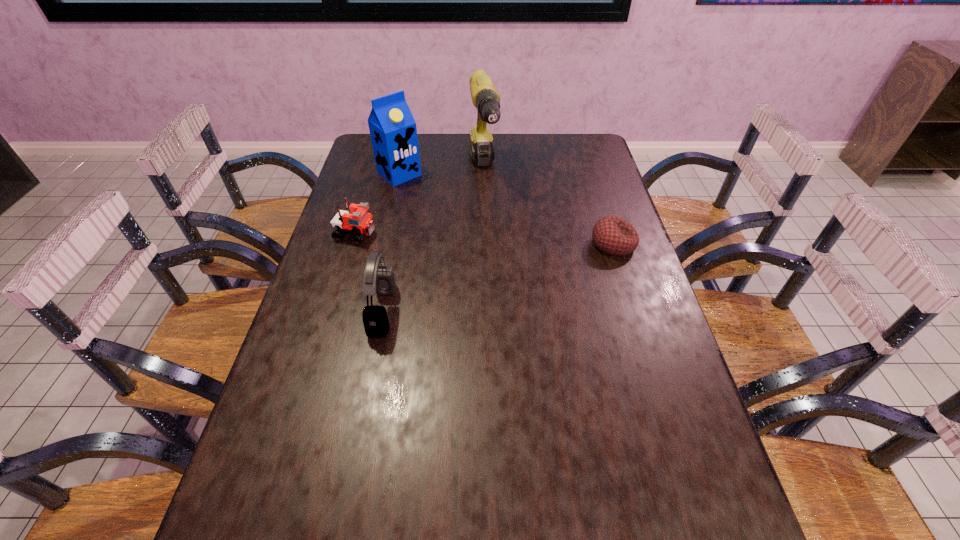
The image size is (960, 540). I want to click on free spot on the desktop that is between the third tallest object and the rightmost object and is positioned on the front-facing side of the fourth tallest object, so click(x=538, y=266).

Image resolution: width=960 pixels, height=540 pixels. What are the coordinates of `free spot on the desktop that is between the nearest object and the beanbag and is positioned on the handle side of the drill` in the screenshot? It's located at (510, 274).

You are a GUI agent. You are given a task and a screenshot of the screen. Output one action in this format:
    pyautogui.click(x=<x>, y=<y>)
    Task: Click on the free spot on the desktop that is between the headset and the shortest object and is positioned with the cap open on the carton
    
    Given the screenshot: What is the action you would take?
    pyautogui.click(x=516, y=272)